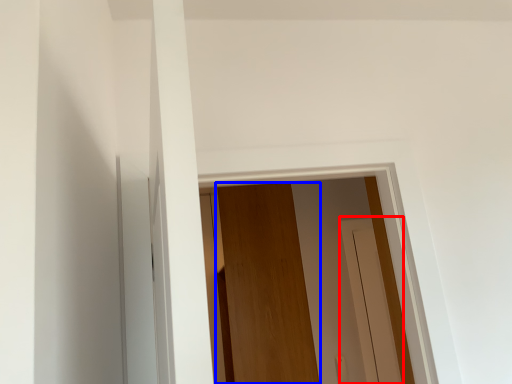
Question: Among these objects, which one is farthest to the camera, screen door (highlighted by a red box) or door (highlighted by a blue box)?

Choices:
 (A) screen door
 (B) door

Answer: (A)